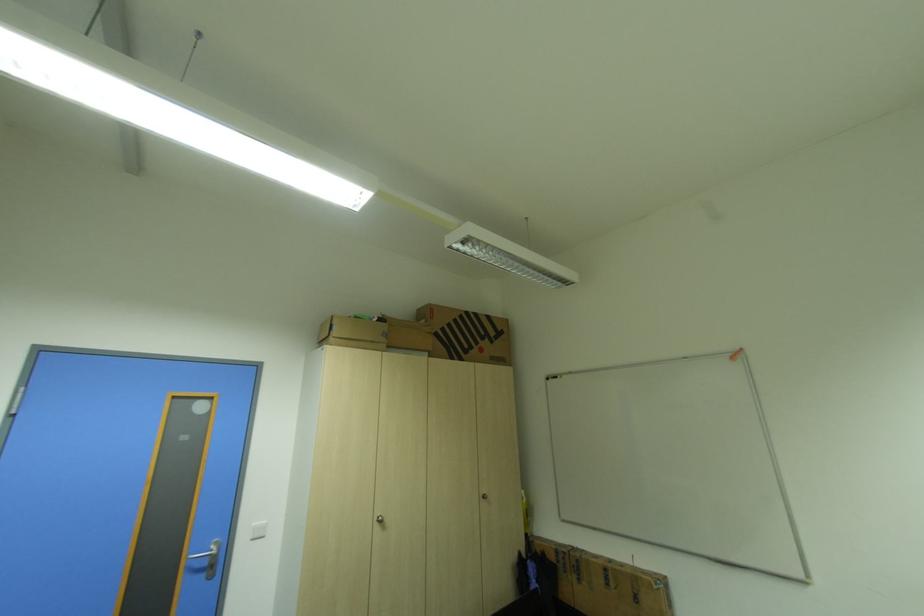
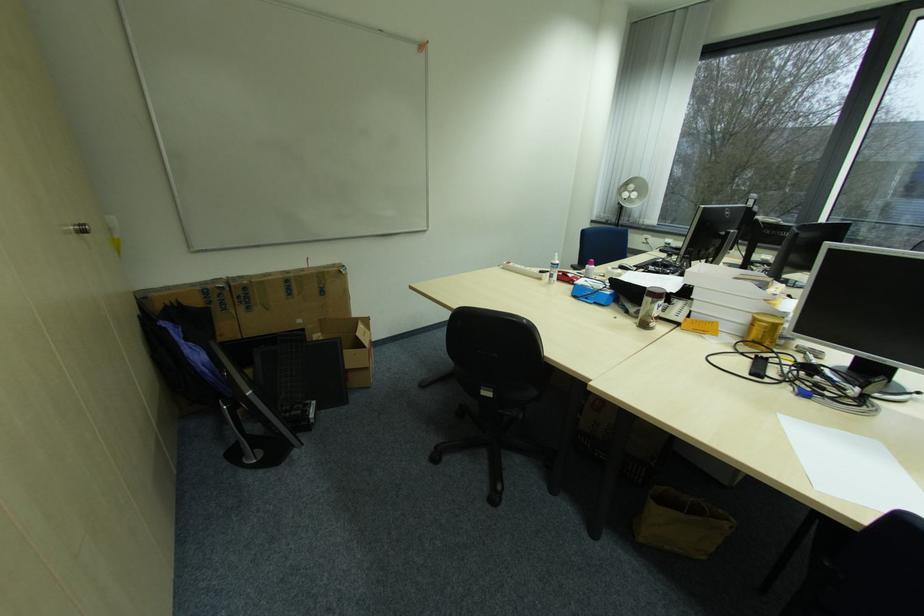
In the second image, find the point that corresponds to point (586, 581) in the first image.

(257, 309)